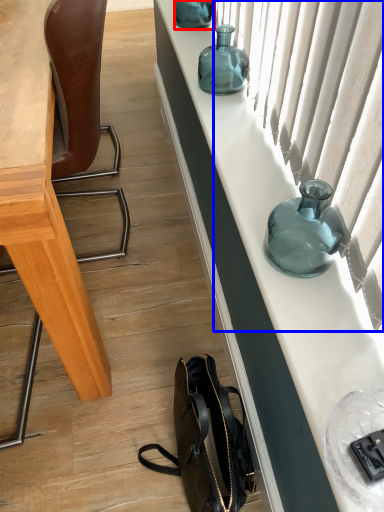
Question: Which point is closer to the camera, bottle (highlighted by a red box) or curtain (highlighted by a blue box)?

Choices:
 (A) bottle
 (B) curtain

Answer: (B)